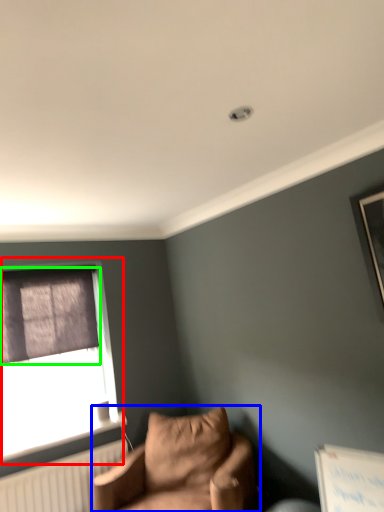
Question: Based on their relative distances, which object is farther from window (highlighted by a red box)? Choose from studio couch (highlighted by a blue box) and curtain (highlighted by a green box).

Choices:
 (A) studio couch
 (B) curtain

Answer: (A)